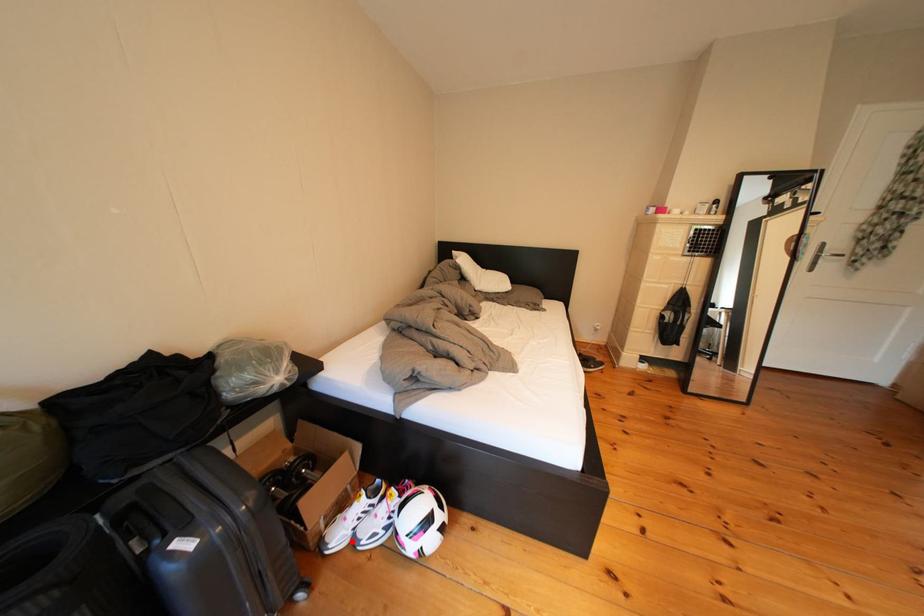
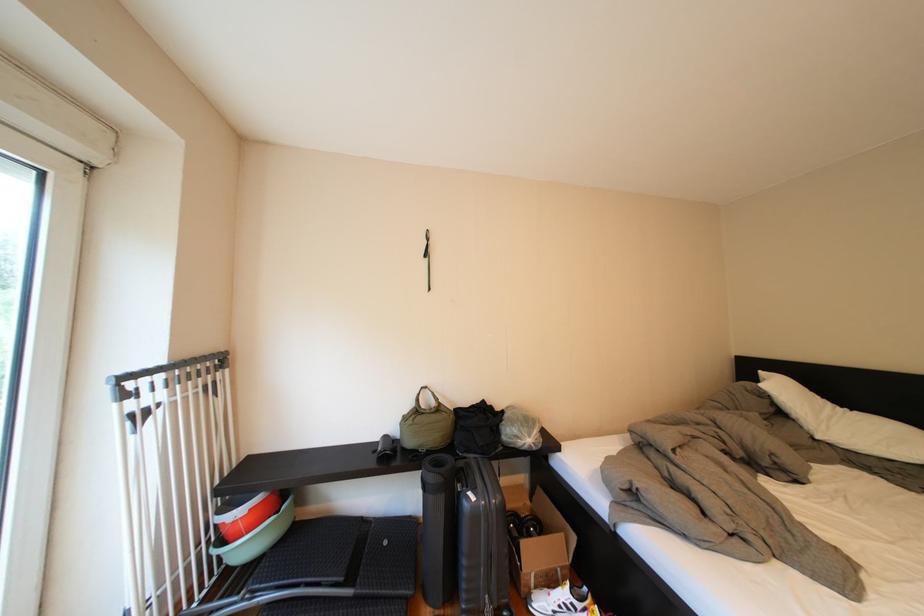
Where in the second image is the point corresponding to the highlighted location from the first image?

(554, 609)